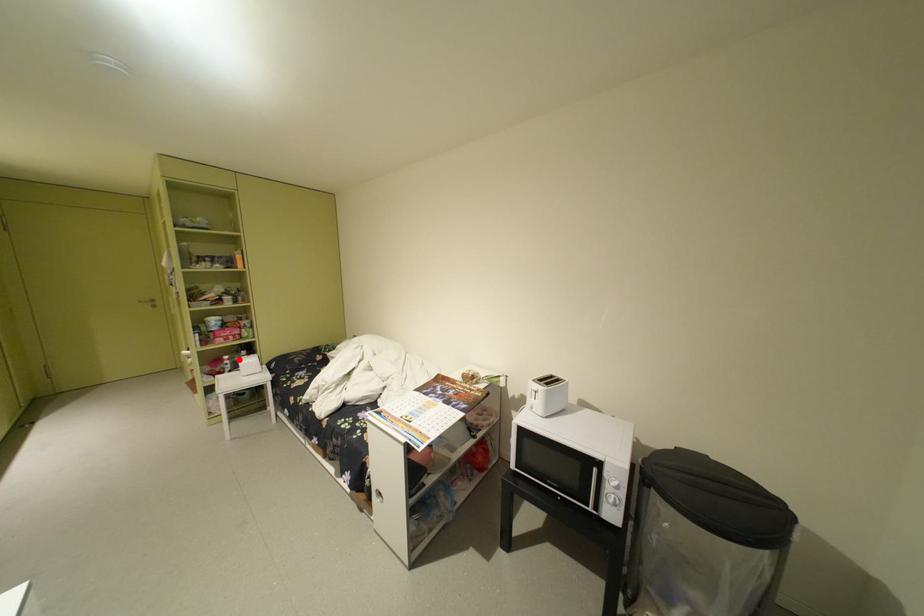
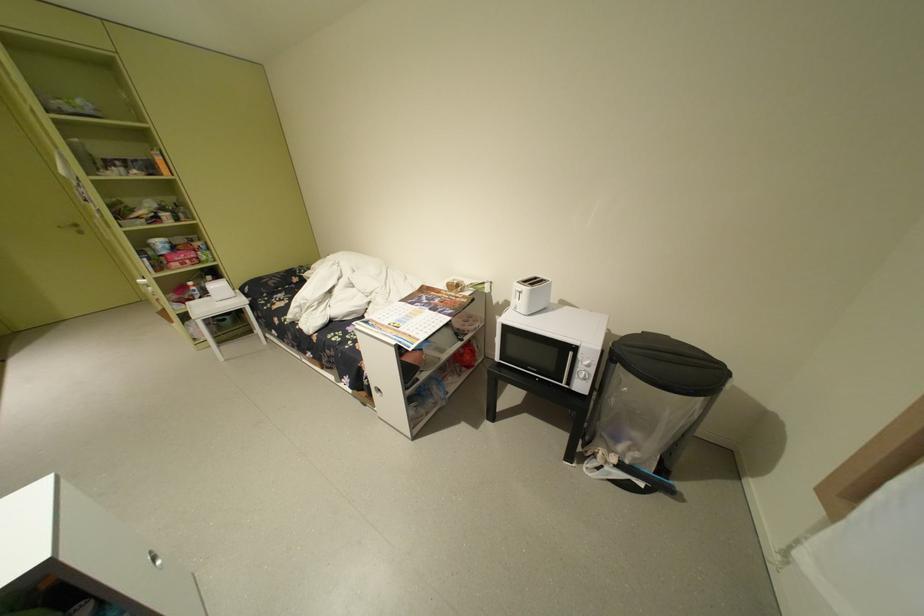
The point at the highlighted location is marked in the first image. Where is the corresponding point in the second image?

(204, 286)